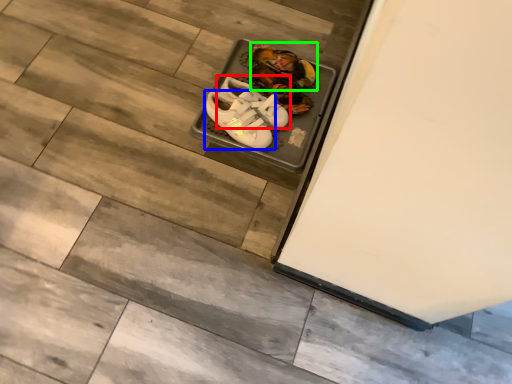
Question: Which is nearer to the footwear (highlighted by a red box)? footwear (highlighted by a blue box) or footwear (highlighted by a green box).

Choices:
 (A) footwear
 (B) footwear

Answer: (A)